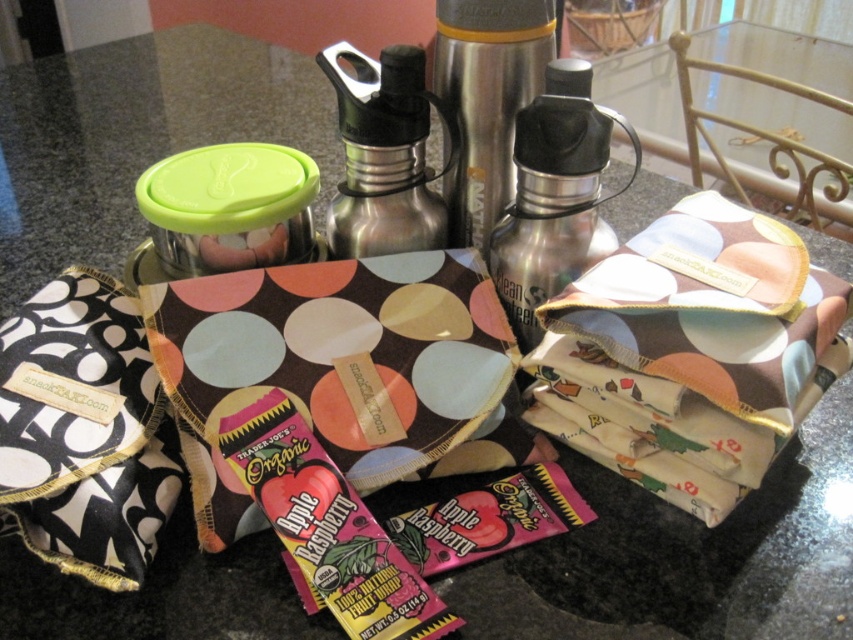
You are organizing a picnic and need to place the shiny metallic water bottle at center and the stainless steel thermos at center into a compartment that can only fit items spaced 2 inches apart. Will they fit together in this space?

The shiny metallic water bottle at center and the stainless steel thermos at center are 2.24 inches apart, so they are too far apart to fit into a compartment that requires items to be spaced only 2 inches apart. Therefore, they cannot be placed together in this space.

You are organizing items on the countertop and need to place the shiny metallic water bottle at center and the stainless steel thermos at center in a specific order. According to their positions, which one is on the left side?

The stainless steel thermos at center is on the left side because the shiny metallic water bottle at center is to the right of it.